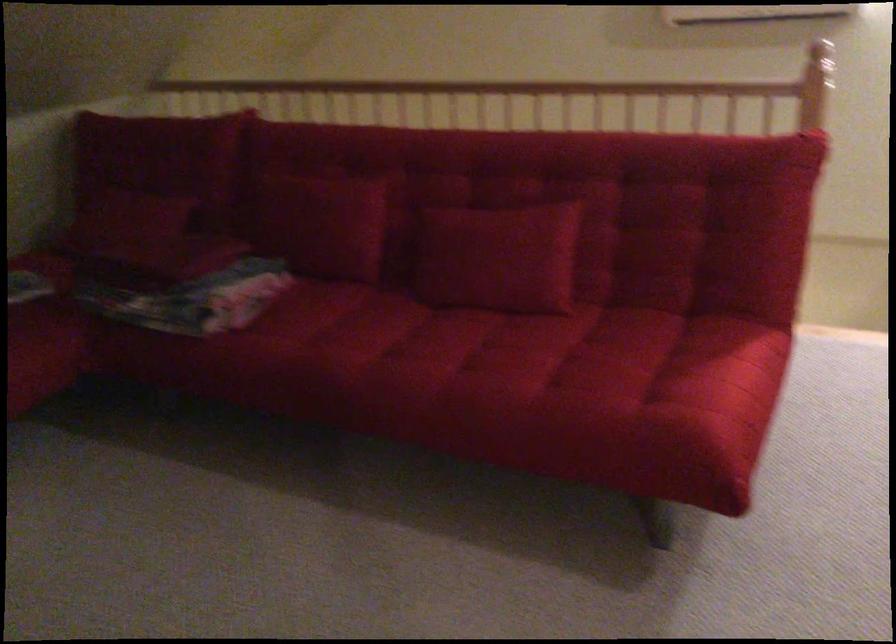
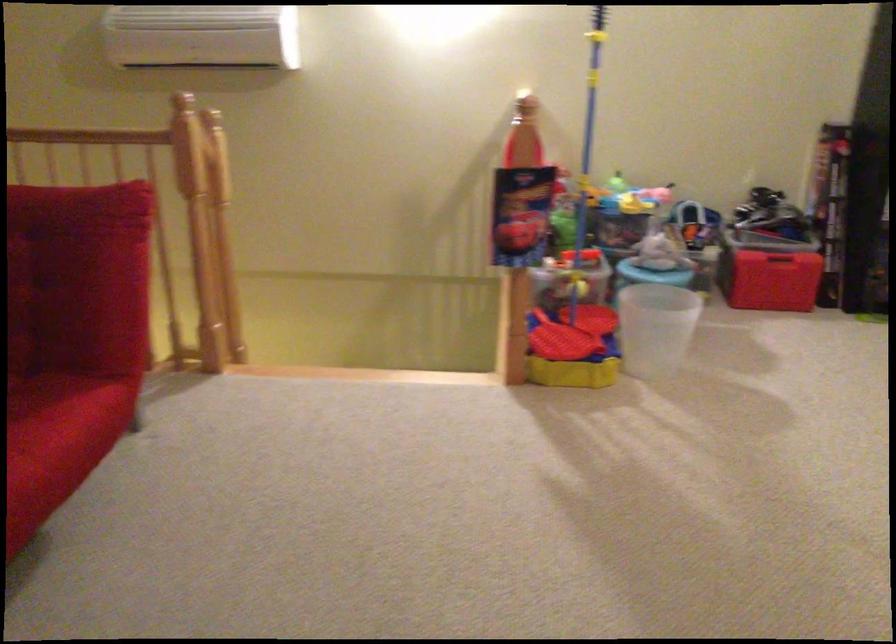
Question: In a continuous first-person perspective shot, in which direction is the camera moving?

Choices:
 (A) Left
 (B) Right
 (C) Forward
 (D) Backward

Answer: (B)